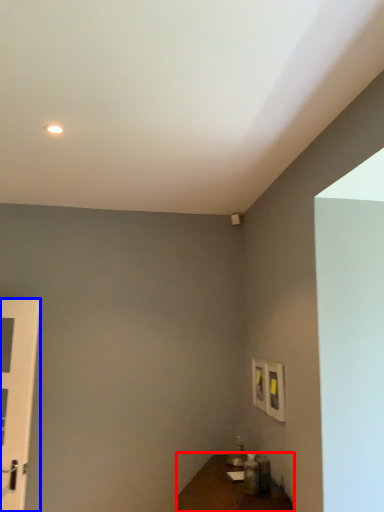
Question: Which of the following is the farthest to the observer, table (highlighted by a red box) or door (highlighted by a blue box)?

Choices:
 (A) table
 (B) door

Answer: (B)